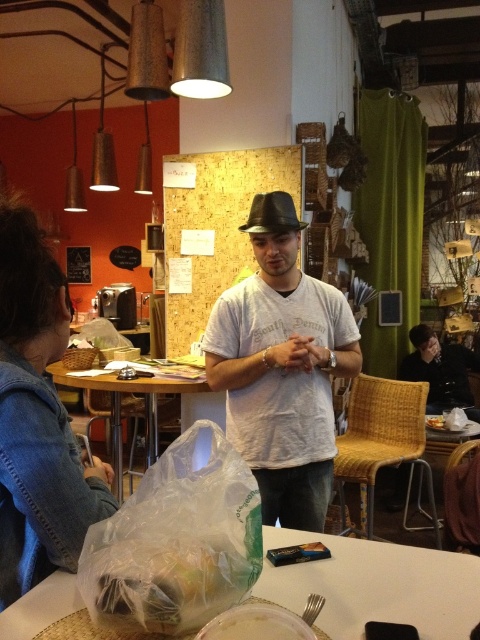
Can you confirm if white matte shirt at center is shorter than clear plastic bag at lower left?

No, white matte shirt at center is not shorter than clear plastic bag at lower left.

Is white matte shirt at center smaller than clear plastic bag at lower left?

Correct, white matte shirt at center occupies less space than clear plastic bag at lower left.

Who is more forward, (261, 426) or (113, 492)?

Point (261, 426)

Where is `white matte shirt at center`? This screenshot has height=640, width=480. white matte shirt at center is located at coordinates (282, 368).

You are a GUI agent. You are given a task and a screenshot of the screen. Output one action in this format:
    pyautogui.click(x=<x>, y=<y>)
    Task: Click on the corkboard at center
    
    Given the screenshot: What is the action you would take?
    pyautogui.click(x=218, y=225)

Does corkboard at center appear over white plastic container at lower center?

Yes.

Locate an element on the screen. The image size is (480, 640). corkboard at center is located at coordinates (218, 225).

Between point (429, 582) and point (300, 166), which one is positioned in front?

Point (429, 582) is more forward.

Does clear plastic bag at lower center come in front of corkboard at center?

Yes, it is in front of corkboard at center.

Is point (418, 586) closer to camera compared to point (167, 212)?

That is True.

This screenshot has width=480, height=640. What are the coordinates of `clear plastic bag at lower center` in the screenshot? It's located at (375, 586).